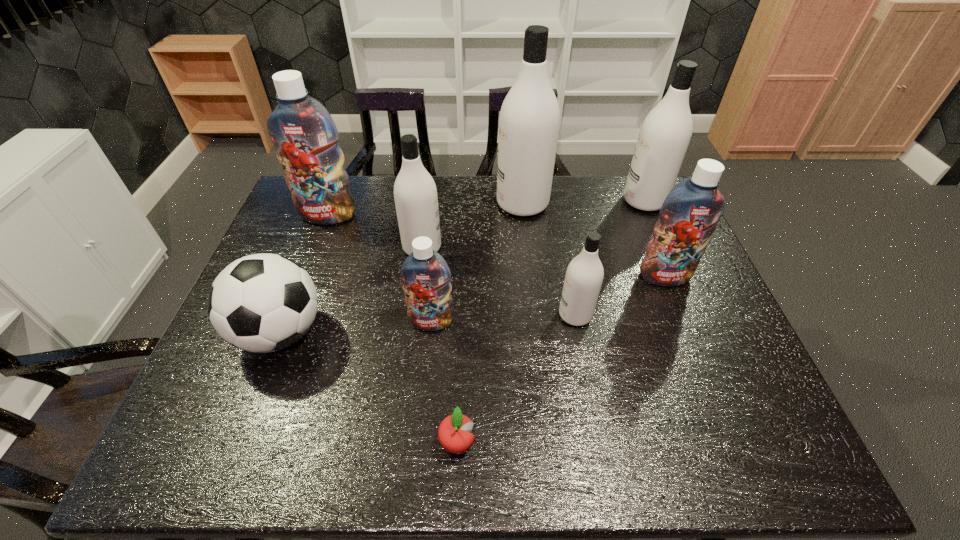
This screenshot has width=960, height=540. In order to click on free location located 0.180m on the left of the shortest object in this screenshot , I will do `click(352, 443)`.

Where is `object present at the near edge`? The image size is (960, 540). object present at the near edge is located at coordinates (454, 435).

Where is `shampoo that is at the left edge`? shampoo that is at the left edge is located at coordinates pyautogui.click(x=305, y=137).

The image size is (960, 540). Find the location of `soccer ball present at the left edge`. soccer ball present at the left edge is located at coordinates (260, 303).

This screenshot has width=960, height=540. In order to click on object that is at the far left corner in this screenshot , I will do `click(305, 137)`.

Locate an element on the screen. The height and width of the screenshot is (540, 960). object that is at the far right corner is located at coordinates (665, 134).

Find the location of a particular element. The image size is (960, 540). free space at the far edge of the desktop is located at coordinates (492, 184).

In the image, there is a desktop. Where is `free space at the near edge`? free space at the near edge is located at coordinates (414, 453).

Identify the location of free space at the right edge of the desktop. (662, 297).

The height and width of the screenshot is (540, 960). In order to click on vacant area between the tallest shampoo and the apple in this screenshot , I will do `click(490, 323)`.